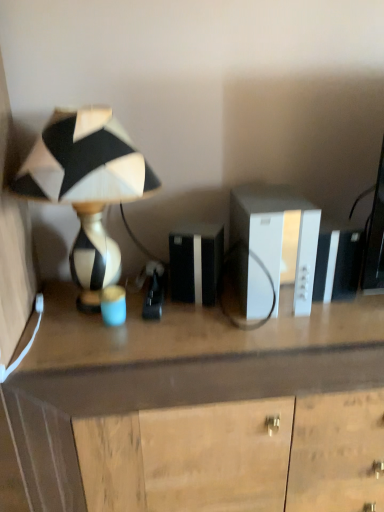
Find the location of `vacant region under black and white ceramic lamp at left (from a real-world perspective)`. vacant region under black and white ceramic lamp at left (from a real-world perspective) is located at coordinates (96, 308).